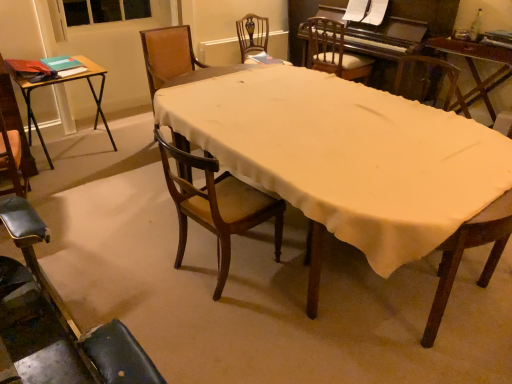
The image size is (512, 384). I want to click on free spot to the right of wooden folding table at left, which is the second table from right to left, so click(x=129, y=168).